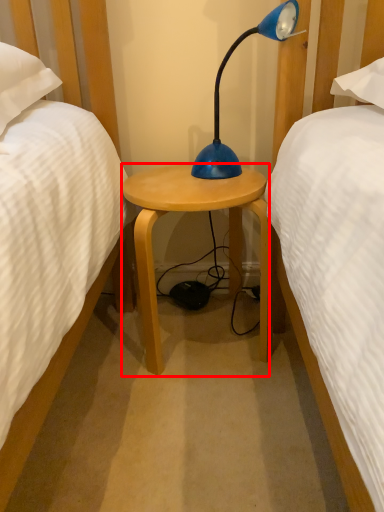
Question: From the image's perspective, considering the relative positions of stool (annotated by the red box) and lamp in the image provided, where is stool (annotated by the red box) located with respect to the staircase?

Choices:
 (A) above
 (B) below

Answer: (B)